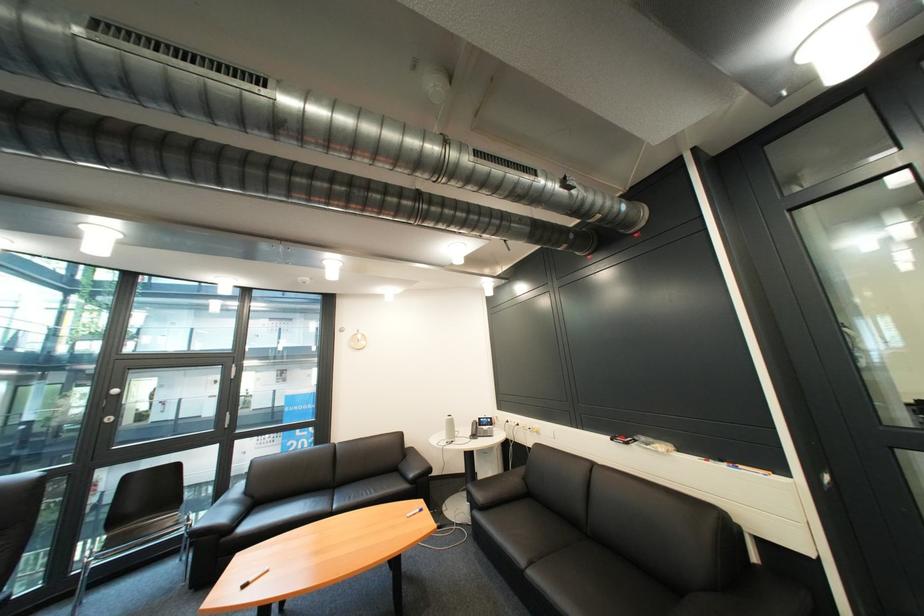
You are a GUI agent. You are given a task and a screenshot of the screen. Output one action in this format:
    pyautogui.click(x=<x>, y=<y>)
    Task: Click on the black chair sitting surface
    This screenshot has height=616, width=924.
    Given the screenshot: What is the action you would take?
    pyautogui.click(x=130, y=535)